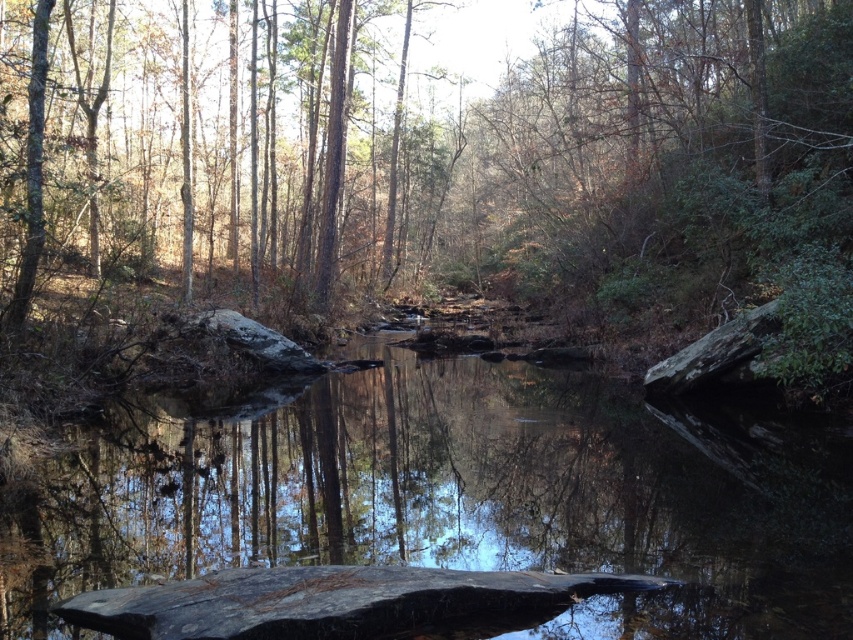
Question: Which object is positioned closest to the smooth dark wood at center?

Choices:
 (A) smooth rock at center
 (B) green leafy tree at center

Answer: (A)

Question: Is green leafy tree at center to the right of smooth rock at center from the viewer's perspective?

Choices:
 (A) yes
 (B) no

Answer: (B)

Question: Can you confirm if green leafy tree at center is smaller than smooth dark wood at center?

Choices:
 (A) yes
 (B) no

Answer: (B)

Question: Which point is closer to the camera taking this photo?

Choices:
 (A) (97, 272)
 (B) (274, 596)
 (C) (492, 458)

Answer: (B)

Question: Which object is closer to the camera taking this photo?

Choices:
 (A) green leafy tree at center
 (B) smooth rock at center
 (C) smooth dark wood at center

Answer: (C)

Question: Does green leafy tree at center have a smaller size compared to smooth dark wood at center?

Choices:
 (A) yes
 (B) no

Answer: (B)